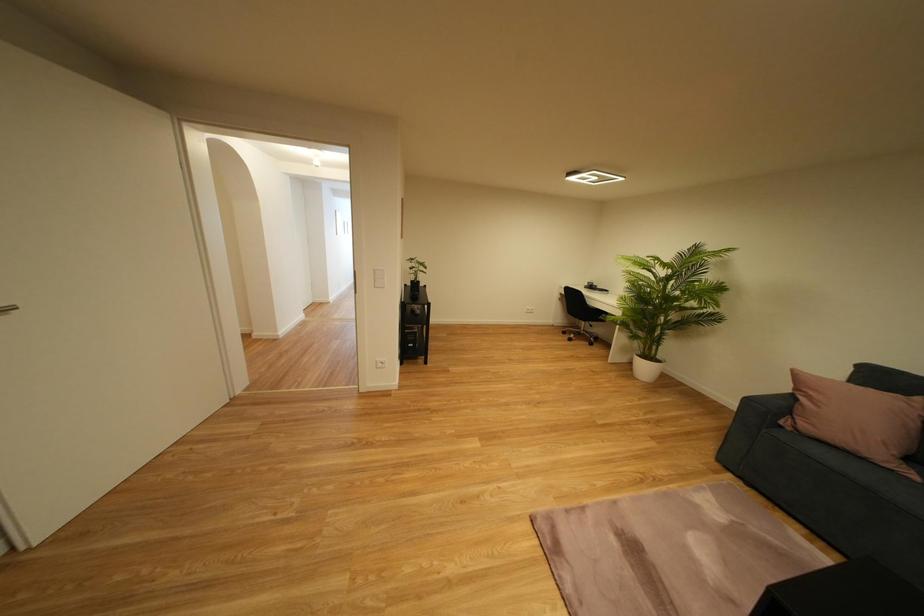
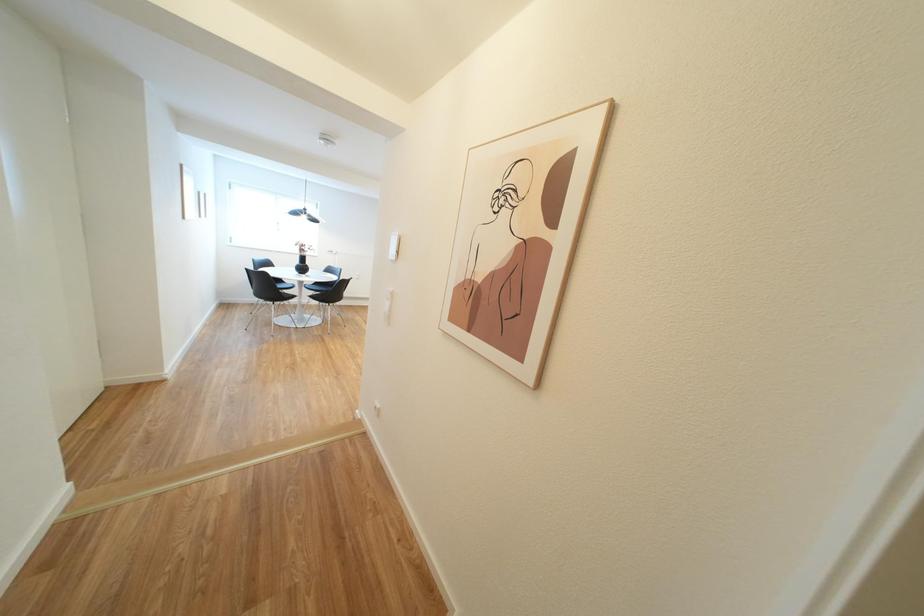
What movement of the cameraman would produce the second image?

The cameraman walked toward left, forward.